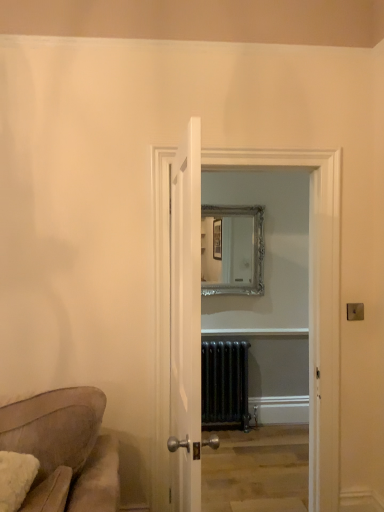
Where is `vacant space underneath black metal radiator at center (from a real-world perspective)`? vacant space underneath black metal radiator at center (from a real-world perspective) is located at coordinates (224, 429).